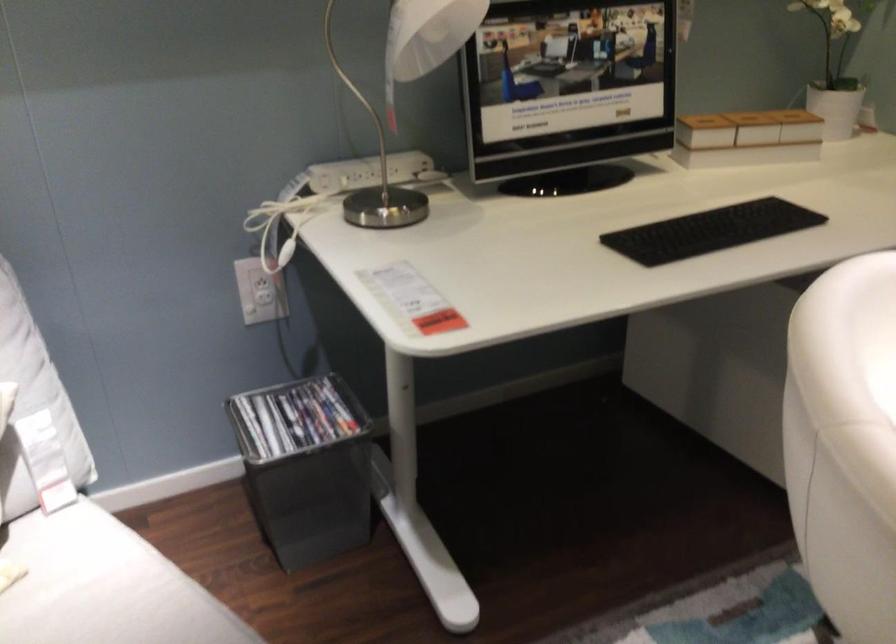
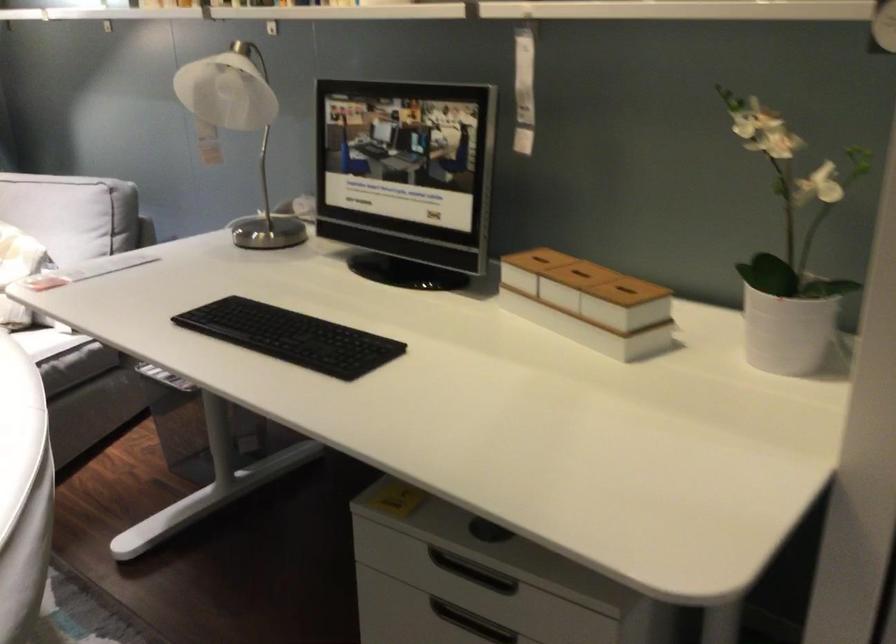
Locate, in the second image, the point that corresponds to point 780,114 in the first image.

(579, 275)